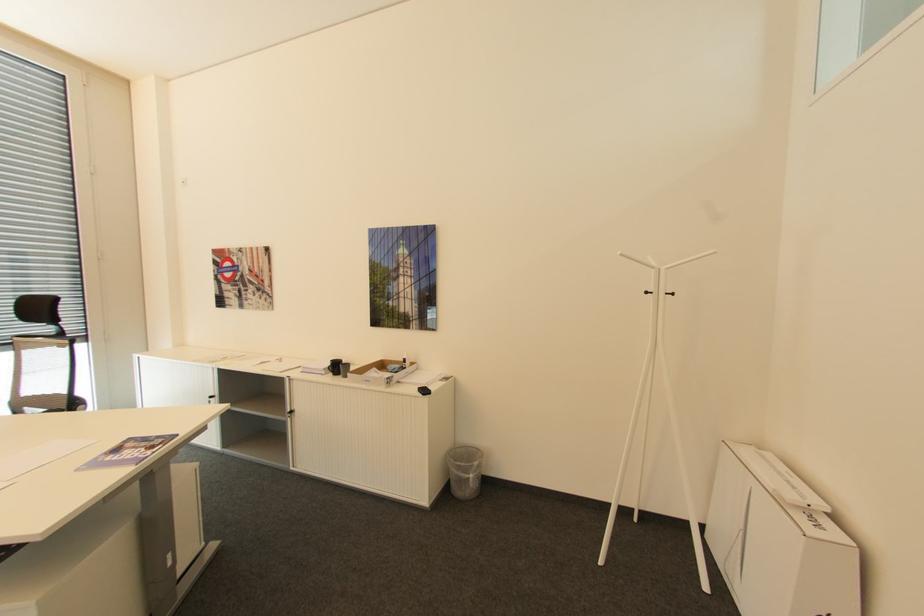
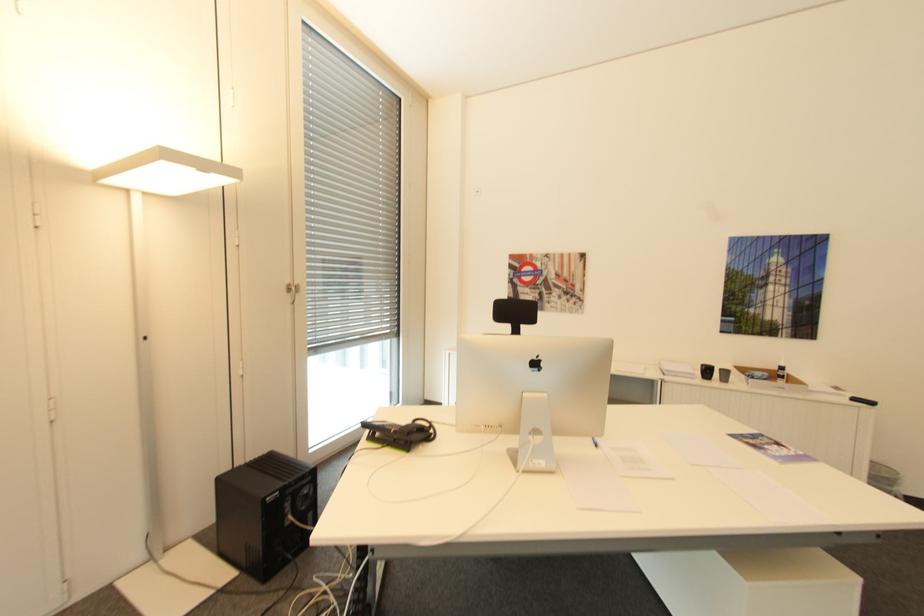
Question: In a continuous first-person perspective shot, in which direction is the camera moving?

Choices:
 (A) Left
 (B) Right
 (C) Forward
 (D) Backward

Answer: (A)